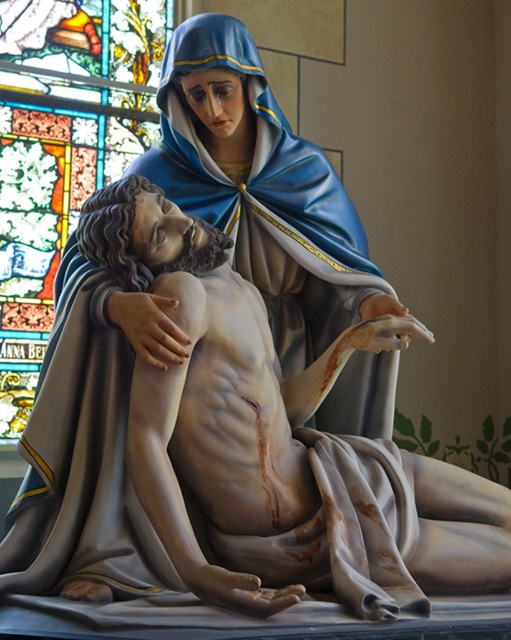
Between matte gray statue at center and stained glass at upper left, which one is positioned lower?

matte gray statue at center is lower down.

Based on the photo, is matte gray statue at center smaller than stained glass at upper left?

Yes.

Which is in front, point (449, 516) or point (3, 1)?

Point (449, 516) is more forward.

Where is `matte gray statue at center`? matte gray statue at center is located at coordinates (236, 452).